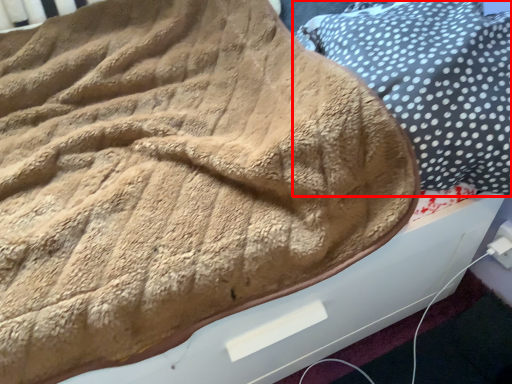
Question: From the image's perspective, considering the relative positions of pillow (annotated by the red box) and electric outlet in the image provided, where is pillow (annotated by the red box) located with respect to the staircase?

Choices:
 (A) below
 (B) above

Answer: (B)